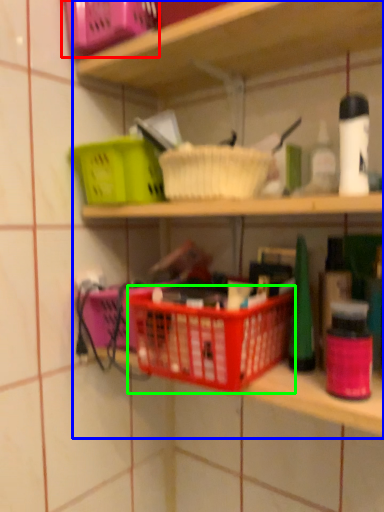
Question: Considering the real-world distances, which object is farthest from basket (highlighted by a red box)? shelf (highlighted by a blue box) or basket container (highlighted by a green box)?

Choices:
 (A) shelf
 (B) basket container

Answer: (B)